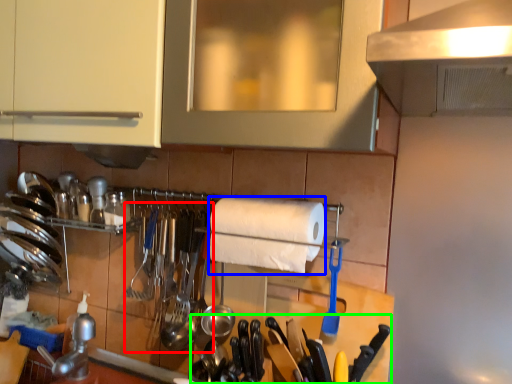
Question: Estimate the real-world distances between objects in this image. Which object is closer to silverware (highlighted by a red box), paper towel (highlighted by a blue box) or cutlery (highlighted by a green box)?

Choices:
 (A) paper towel
 (B) cutlery

Answer: (B)